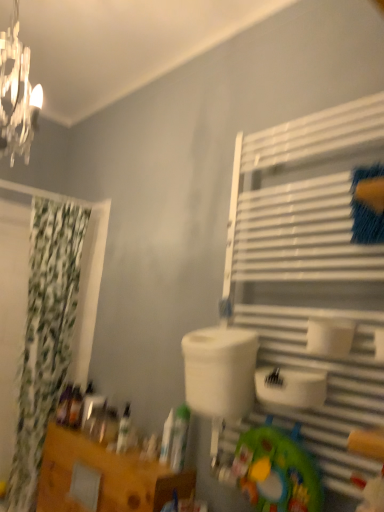
Question: Is point (319, 250) positioned closer to the camera than point (125, 420)?

Choices:
 (A) closer
 (B) farther

Answer: (A)

Question: Looking at their shapes, would you say white metal shelf at right is wider or thinner than white matte bottle at lower left, placed as the 3th toiletry when sorted from back to front?

Choices:
 (A) wide
 (B) thin

Answer: (A)

Question: Which of these objects is positioned farthest from the translucent plastic bottle at lower left, which ranks as the first toiletry in back-to-front order?

Choices:
 (A) green fabric curtain at left
 (B) white matte bottle at center, which is the second toiletry in front-to-back order
 (C) white matte tube at center, the 5th toiletry viewed from the left
 (D) white matte toilet paper at center-right
 (E) translucent plastic bottle at lower left, marked as the fourth toiletry in a right-to-left arrangement

Answer: (D)

Question: Considering the real-world distances, which object is farthest from the plastic green toy at lower center?

Choices:
 (A) translucent plastic bottle at lower left, which ranks as the first toiletry in back-to-front order
 (B) white metal shelf at right
 (C) wooden table at lower left
 (D) white matte bottle at lower left, placed as the third toiletry when sorted from front to back
 (E) white matte tube at center, the 5th toiletry viewed from the left

Answer: (A)